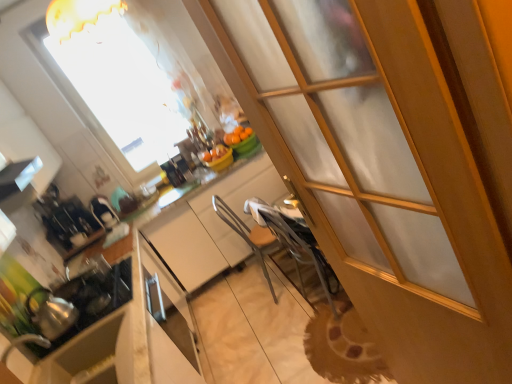
Question: Based on their sizes in the image, would you say white glossy exhaust hood at upper left is bigger or smaller than satin black iron at center, marked as the 1th appliance in a back-to-front arrangement?

Choices:
 (A) big
 (B) small

Answer: (A)

Question: From a real-world perspective, relative to satin black iron at center, the 3th appliance from the front, is white glossy exhaust hood at upper left vertically above or below?

Choices:
 (A) above
 (B) below

Answer: (A)

Question: Which of these objects is positioned farthest from the metallic silver chair at center?

Choices:
 (A) white glossy counter at center
 (B) transparent glass screen door at center
 (C) satin black iron at center, marked as the 1th appliance in a back-to-front arrangement
 (D) shiny silver tea pot at lower left
 (E) transparent glass window at upper center

Answer: (B)

Question: Which of these objects is positioned farthest from the satin black iron at center, the 3th appliance from the front?

Choices:
 (A) matte white cabinet at center
 (B) white glossy counter at center
 (C) transparent glass screen door at center
 (D) transparent glass window at upper center
 (E) metallic silver chair at center

Answer: (C)